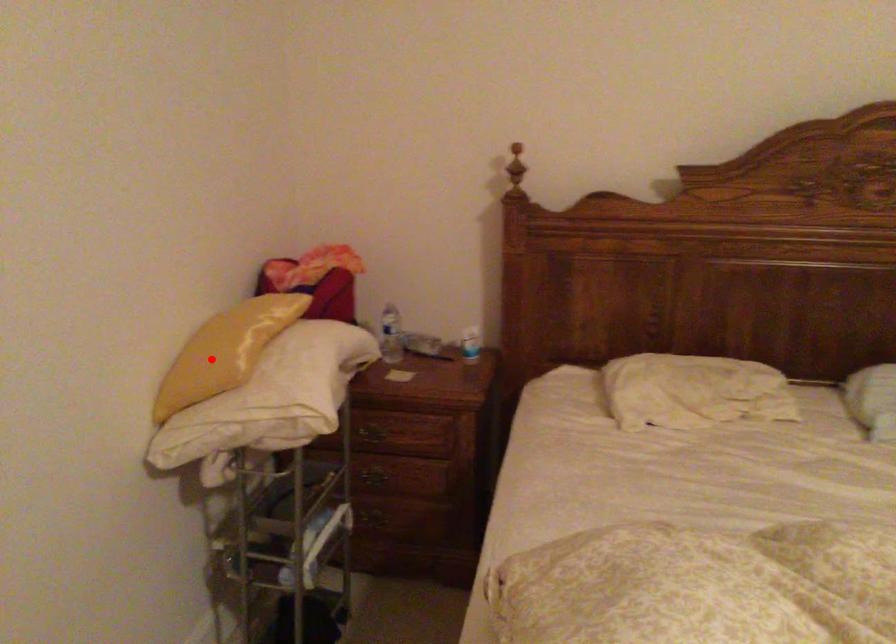
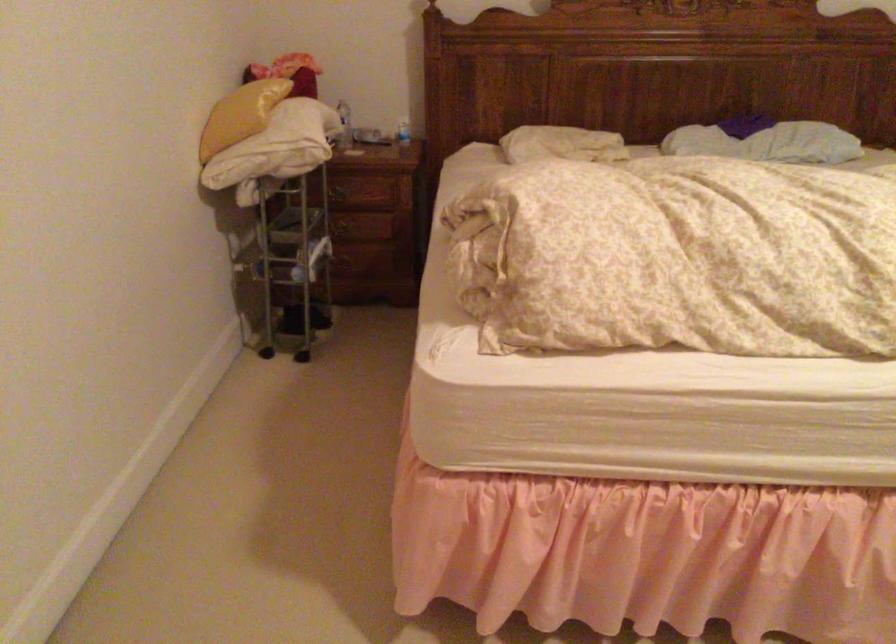
Locate, in the second image, the point that corresponds to the highlighted location in the first image.

(240, 115)